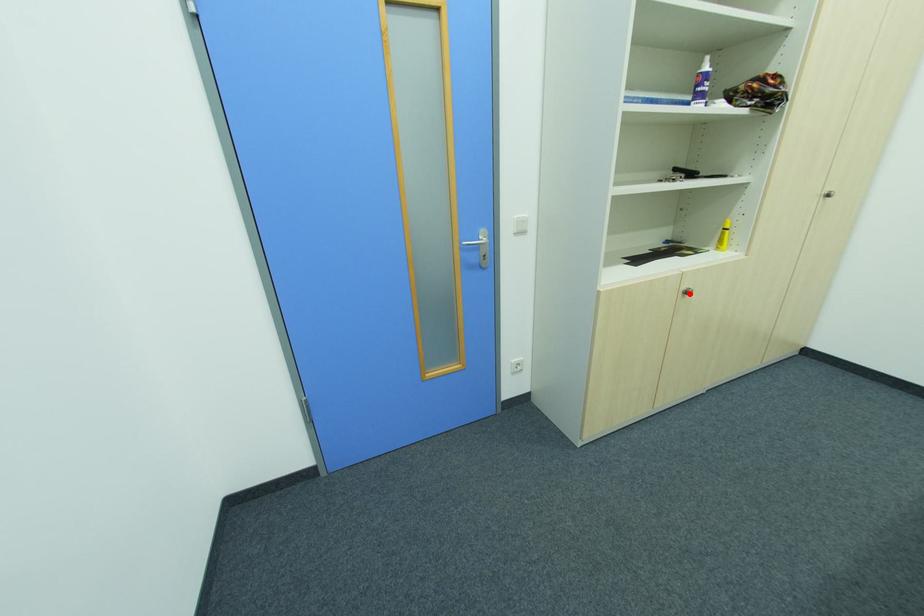
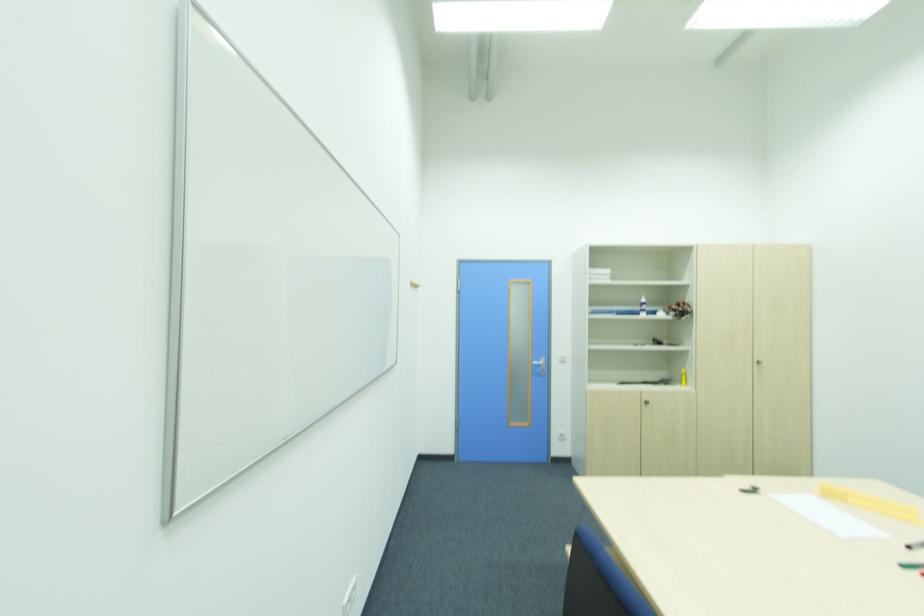
Locate, in the second image, the point that corresponds to the highlighted location in the first image.

(650, 402)